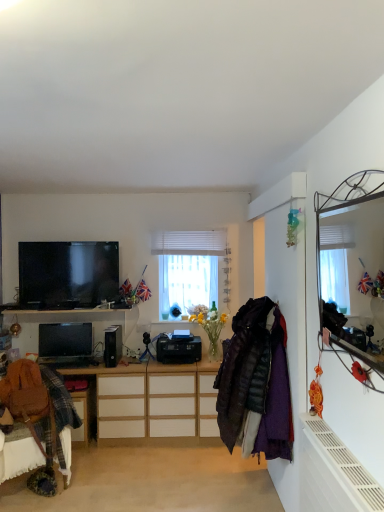
The width and height of the screenshot is (384, 512). Identify the location of vacant space situated above metallic mirror at upper right (from a real-world perspective). (345, 174).